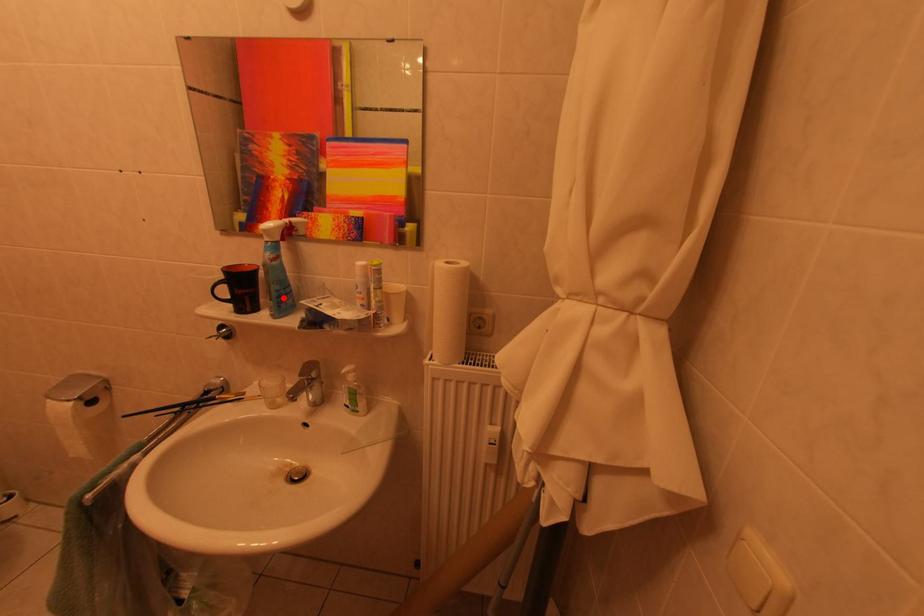
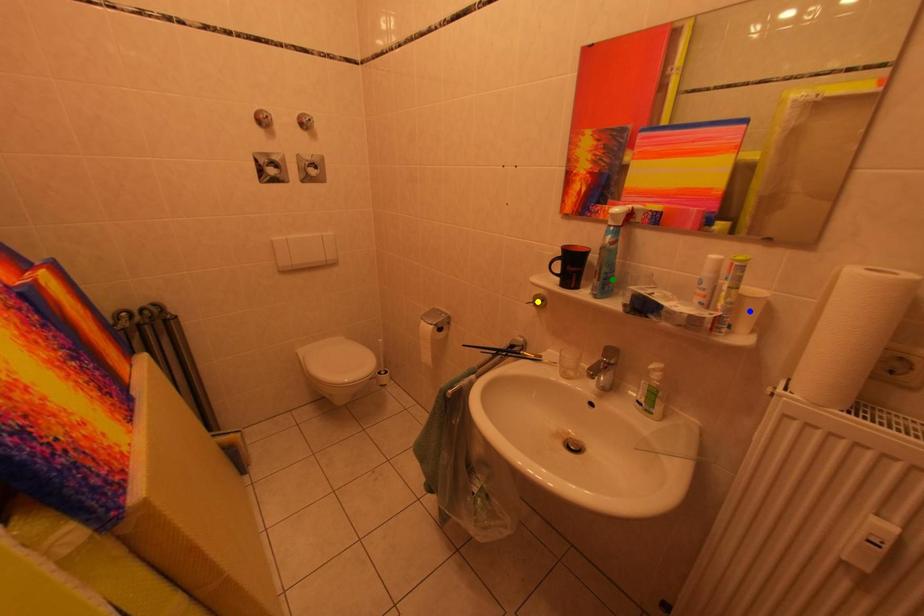
Question: I am providing you with two images of the same scene from different viewpoints. A red point is marked on the first image. You are given multiple points on the second image. Which mark in image 2 goes with the point in image 1?

Choices:
 (A) green point
 (B) blue point
 (C) yellow point

Answer: (A)